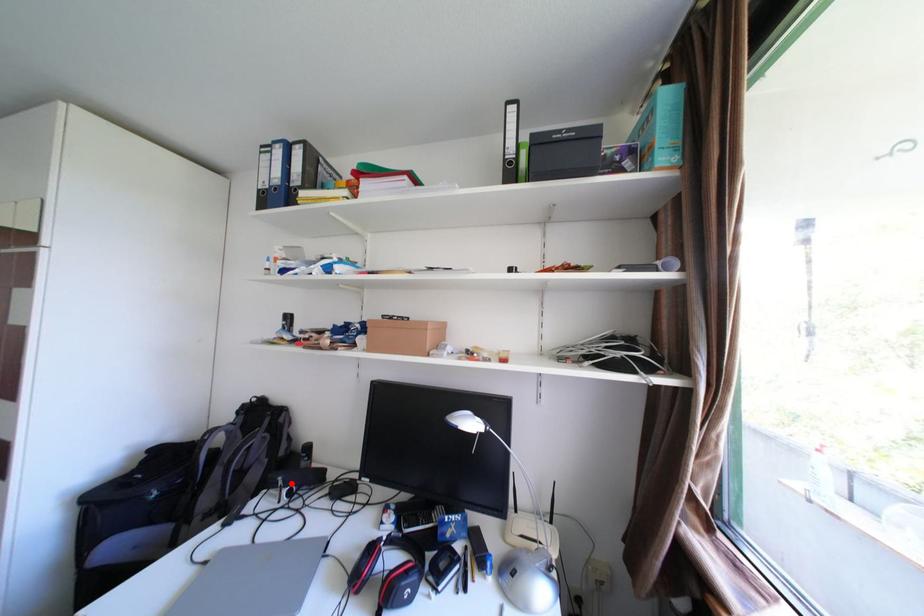
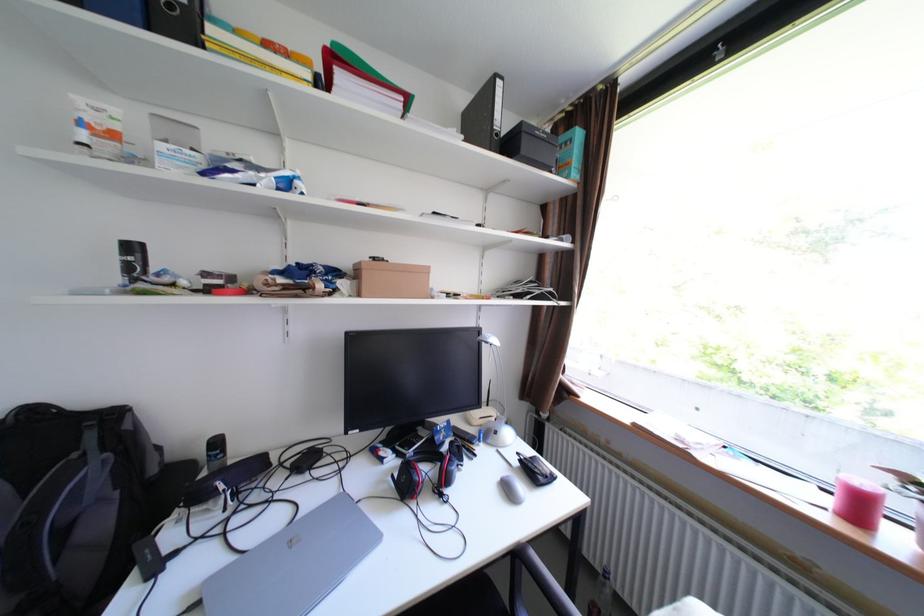
Where in the second image is the point corresponding to the highlighted location from the first image?

(233, 488)